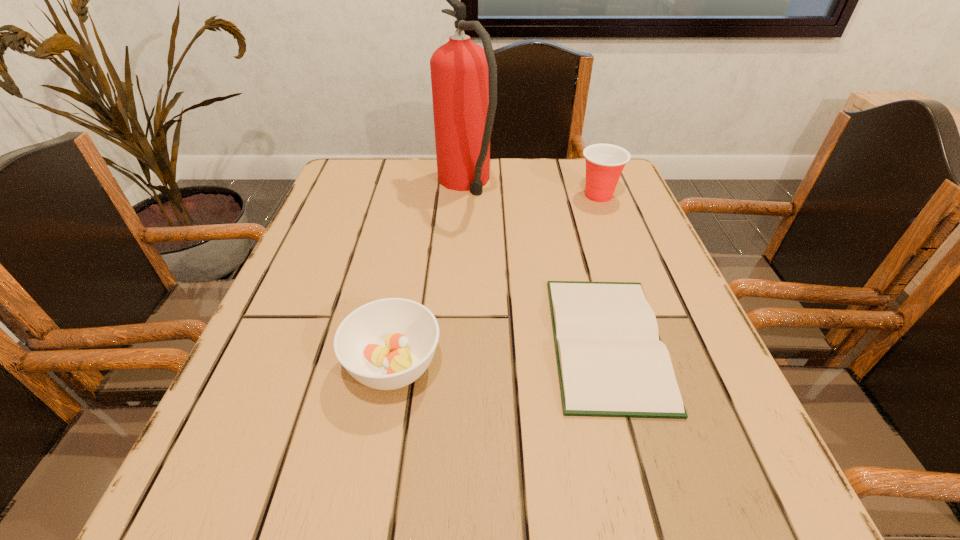
The image size is (960, 540). Find the location of `the tallest object`. the tallest object is located at coordinates (463, 75).

The image size is (960, 540). In order to click on cup in this screenshot , I will do `click(604, 162)`.

Locate an element on the screen. This screenshot has height=540, width=960. soup bowl is located at coordinates (387, 344).

Where is `hardback book`? The image size is (960, 540). hardback book is located at coordinates (611, 361).

Find the location of a particular element. The height and width of the screenshot is (540, 960). free region located on the front of the third shortest object is located at coordinates (643, 314).

The image size is (960, 540). I want to click on free point located 0.090m on the back of the third tallest object, so click(x=406, y=292).

Image resolution: width=960 pixels, height=540 pixels. I want to click on vacant space positioned 0.200m on the left of the hardback book, so click(430, 342).

At what (x,y) coordinates should I click in order to perform the action: click on fire extinguisher located in the far edge section of the desktop. Please return your answer as a coordinate pair (x, y). Image resolution: width=960 pixels, height=540 pixels. Looking at the image, I should click on (463, 75).

This screenshot has width=960, height=540. Find the location of `cup present at the far edge`. cup present at the far edge is located at coordinates (604, 162).

Where is `object positioned at the left edge`? The height and width of the screenshot is (540, 960). object positioned at the left edge is located at coordinates (387, 344).